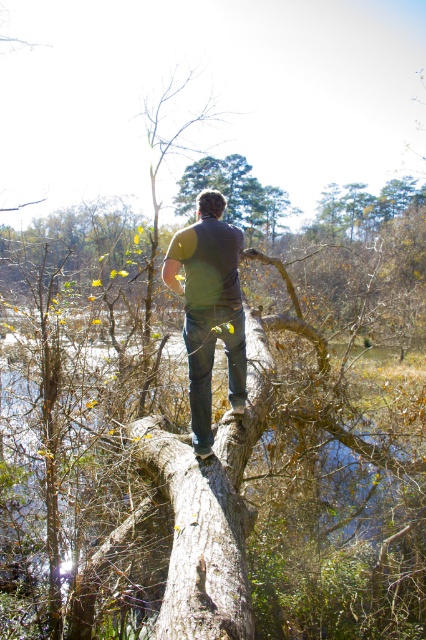
The width and height of the screenshot is (426, 640). What do you see at coordinates (209, 509) in the screenshot? I see `smooth brown log at center` at bounding box center [209, 509].

Consider the image. Can you confirm if smooth brown log at center is taller than dark gray shirt at center?

In fact, smooth brown log at center may be shorter than dark gray shirt at center.

Which is behind, point (146, 417) or point (230, 376)?

The point (146, 417) is more distant.

Find the location of a particular element. The width and height of the screenshot is (426, 640). smooth brown log at center is located at coordinates (209, 509).